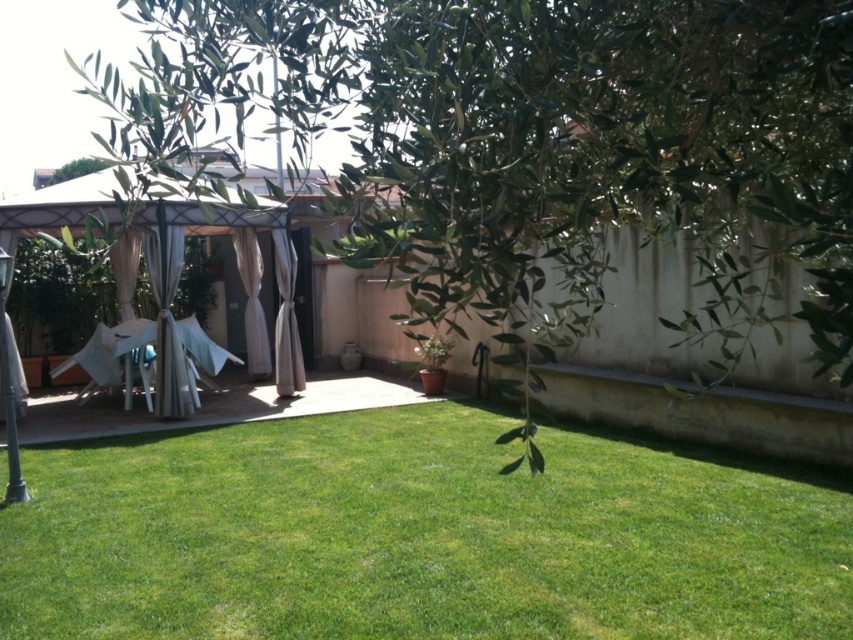
You are planning to install a small garden bench in the garden. The bench requires a space of 4 meters between the green leafy tree at upper center and the green grass at center to be placed. Can the bench be accommodated in the available space?

The green leafy tree at upper center and green grass at center are 5.02 meters apart, which is more than the required 4 meters. Therefore, the bench can be accommodated in the available space.

You are planning to install a small garden bench in the garden scene. The bench requires a space that is not occupied by the green leafy tree at upper center or the green grass at center. Based on their sizes, which object might leave more space for the bench?

The green leafy tree at upper center is larger in size than the green grass at center, so the area around the green grass at center would leave more space for the bench.